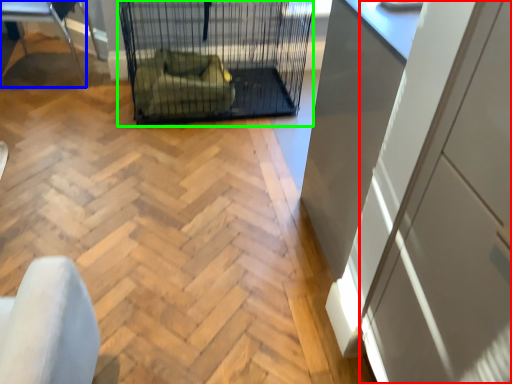
Question: Which object is positioned farthest from screen door (highlighted by a red box)? Select from furniture (highlighted by a blue box) and bird cage (highlighted by a green box).

Choices:
 (A) furniture
 (B) bird cage

Answer: (A)